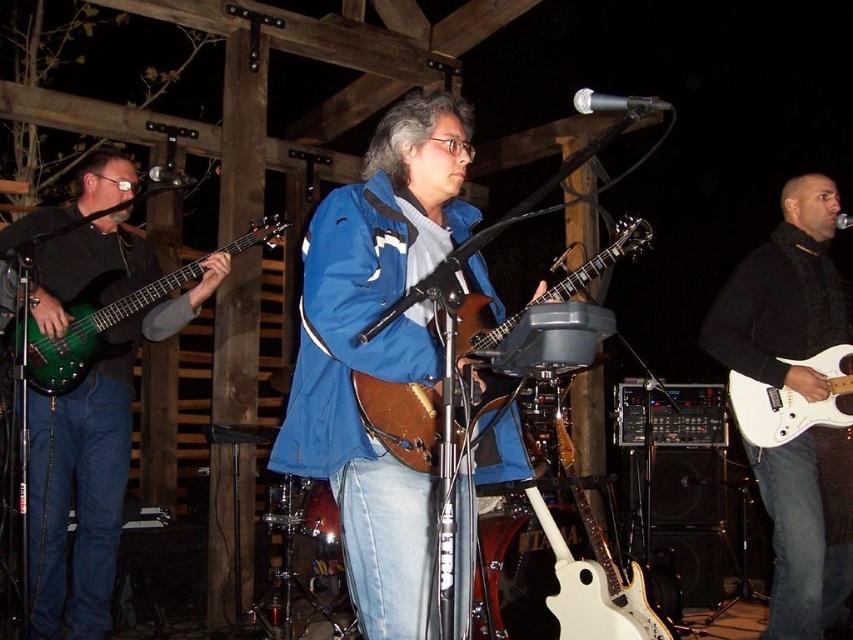
Can you confirm if white matte electric guitar at right is wider than green glossy electric guitar at left?

No, white matte electric guitar at right is not wider than green glossy electric guitar at left.

Is point (828, 470) less distant than point (51, 358)?

No.

Identify the location of white matte electric guitar at right. (784, 296).

Is matte brown guitar at center thinner than green glossy bass guitar at left?

Yes, matte brown guitar at center is thinner than green glossy bass guitar at left.

Does matte brown guitar at center lie behind green glossy bass guitar at left?

No.

Find the location of `matte brown guitar at center`. matte brown guitar at center is located at coordinates (378, 349).

From the picture: Is white matte electric guitar at right positioned before white glossy electric guitar at right?

No.

Which is in front, point (828, 547) or point (795, 368)?

Positioned in front is point (795, 368).

The height and width of the screenshot is (640, 853). What are the coordinates of `white matte electric guitar at right` in the screenshot? It's located at (784, 296).